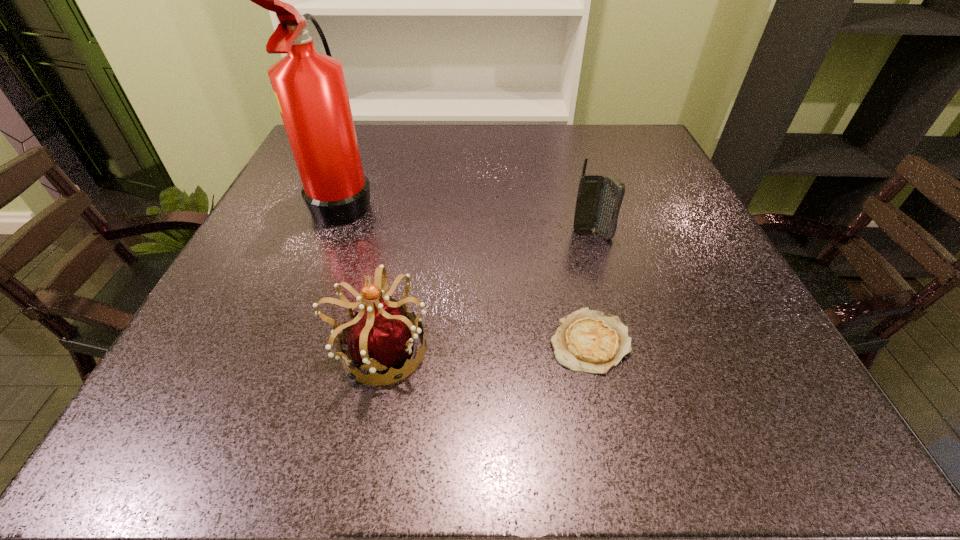
Locate an element on the screen. The width and height of the screenshot is (960, 540). fire extinguisher is located at coordinates (310, 89).

At what (x,y) coordinates should I click in order to perform the action: click on cellular telephone. Please return your answer as a coordinate pair (x, y). This screenshot has width=960, height=540. Looking at the image, I should click on (599, 199).

Locate an element on the screen. This screenshot has height=540, width=960. tiara is located at coordinates (381, 335).

Image resolution: width=960 pixels, height=540 pixels. In order to click on quiche in this screenshot , I will do `click(588, 341)`.

Where is `free spot located 0.270m at the spray nozzle of the fire extinguisher`? Image resolution: width=960 pixels, height=540 pixels. free spot located 0.270m at the spray nozzle of the fire extinguisher is located at coordinates (496, 200).

Where is `vacant space located 0.340m on the keyboard of the cellular telephone`? The height and width of the screenshot is (540, 960). vacant space located 0.340m on the keyboard of the cellular telephone is located at coordinates (638, 393).

You are a GUI agent. You are given a task and a screenshot of the screen. Output one action in this format:
    pyautogui.click(x=<x>, y=<y>)
    Task: Click on the vacant region located on the front-facing side of the tiara
    The image size is (960, 540).
    Given the screenshot: What is the action you would take?
    pyautogui.click(x=584, y=350)

Where is `free space located 0.200m on the right of the quiche`? The height and width of the screenshot is (540, 960). free space located 0.200m on the right of the quiche is located at coordinates (756, 341).

This screenshot has width=960, height=540. Find the location of `object at the near edge`. object at the near edge is located at coordinates (381, 335).

The width and height of the screenshot is (960, 540). I want to click on object that is at the left edge, so click(x=310, y=89).